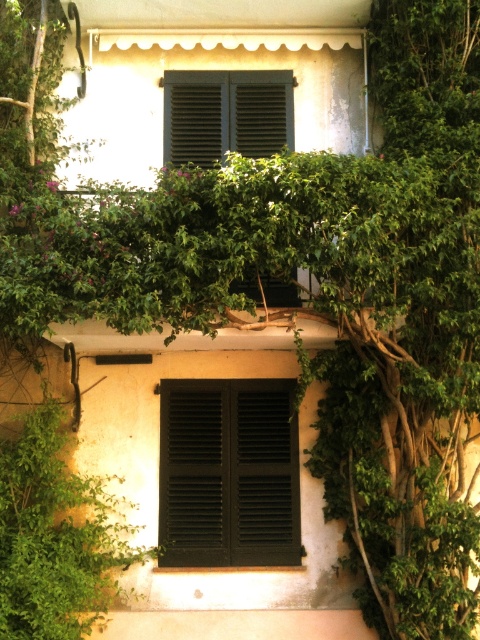
You are an architect evaluating the building facade. You notice two matte black shutters at center and matte black shutters at upper center. Which of these two shutters is positioned to the right of the other?

The matte black shutters at center is positioned to the right of the matte black shutters at upper center.

You are standing in front of the rustic building and want to touch both the matte black shutters at center and the matte black shutters at upper center. Which one would you need to reach out further to touch?

You would need to reach out further to touch the matte black shutters at upper center because the matte black shutters at center is closer to the viewer than matte black shutters at upper center.

You are standing in front of the rustic building and want to clean the matte black shutters at center and the matte black shutters at upper center. Which one should you clean first if you want to start from the lower one?

You should clean the matte black shutters at center first because it is located below the matte black shutters at upper center.